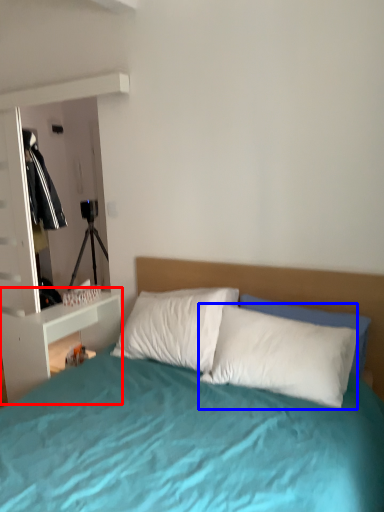
Question: Which of the following is the closest to the observer, nightstand (highlighted by a red box) or pillow (highlighted by a blue box)?

Choices:
 (A) nightstand
 (B) pillow

Answer: (B)